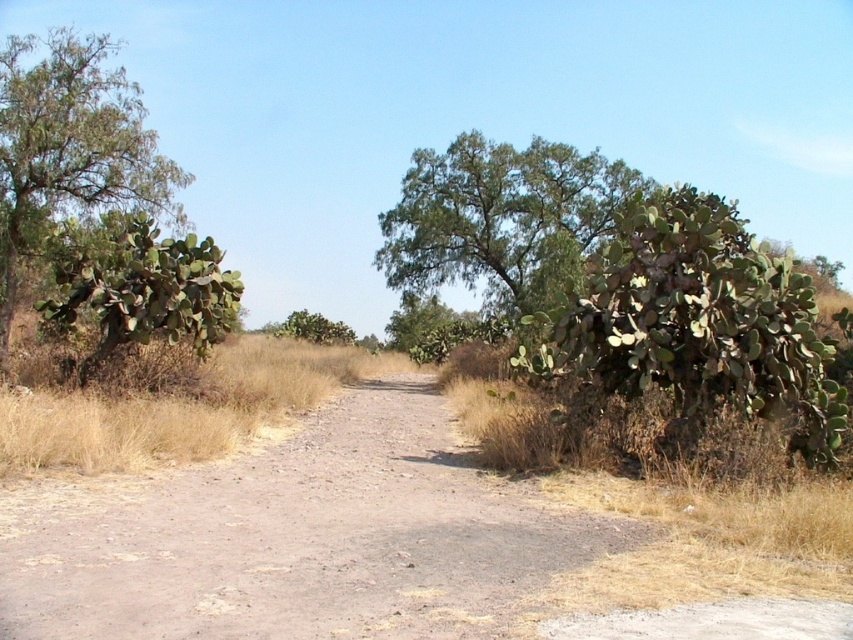
You are standing on the dirt road at center and want to reach the green spiny cactus at right. Which direction should you move to get there?

The dirt road at center is to the left of green spiny cactus at right, so you should move to the right to reach it.

You are standing at the end of the dirt path and want to walk towards the green leafy tree at center. However, there is another green leafy tree at left in your way. Which direction should you adjust your path to avoid it?

The green leafy tree at center is located above the green leafy tree at left, so you should adjust your path upwards to avoid the green leafy tree at left and reach the green leafy tree at center.